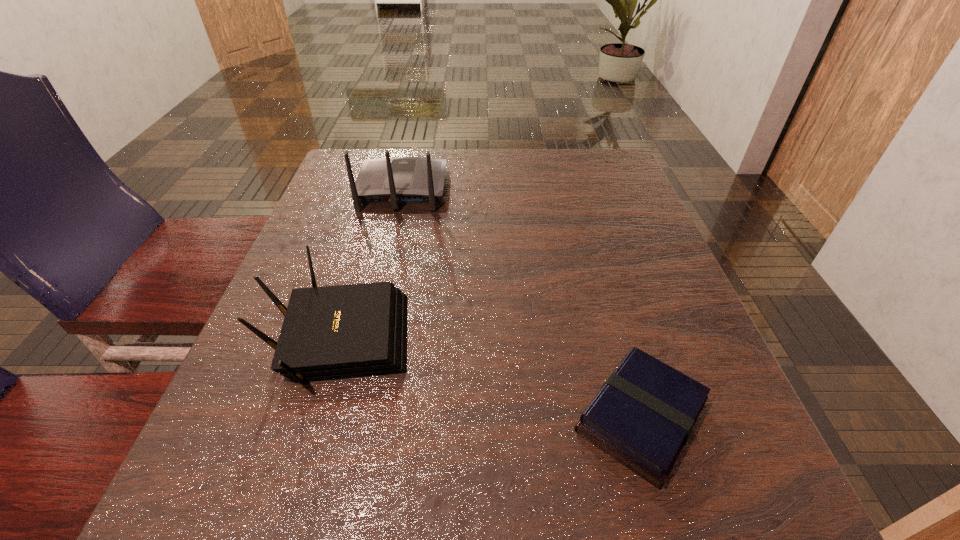
This screenshot has width=960, height=540. In order to click on the farther router in this screenshot , I will do `click(399, 180)`.

Image resolution: width=960 pixels, height=540 pixels. Identify the location of the tallest object. (399, 180).

Identify the location of the second tallest object. [336, 332].

You are a GUI agent. You are given a task and a screenshot of the screen. Output one action in this format:
    pyautogui.click(x=<x>, y=<y>)
    Task: Click on the shorter router
    
    Given the screenshot: What is the action you would take?
    pyautogui.click(x=336, y=332)

I want to click on the shortest object, so click(x=643, y=415).

Where is `book`? The image size is (960, 540). book is located at coordinates (643, 415).

Identify the location of free region located 0.090m on the front-facing side of the taller router. (411, 152).

Find the location of `vacant space situated 0.080m on the front-facing side of the taller router`. vacant space situated 0.080m on the front-facing side of the taller router is located at coordinates (411, 153).

At what (x,y) coordinates should I click in order to perform the action: click on vacant region located 0.110m on the right of the second shortest object. Please return your answer as a coordinate pair (x, y). This screenshot has height=540, width=960. Looking at the image, I should click on (476, 338).

The height and width of the screenshot is (540, 960). Identify the location of free spot located 0.320m on the left of the shortest object. (351, 417).